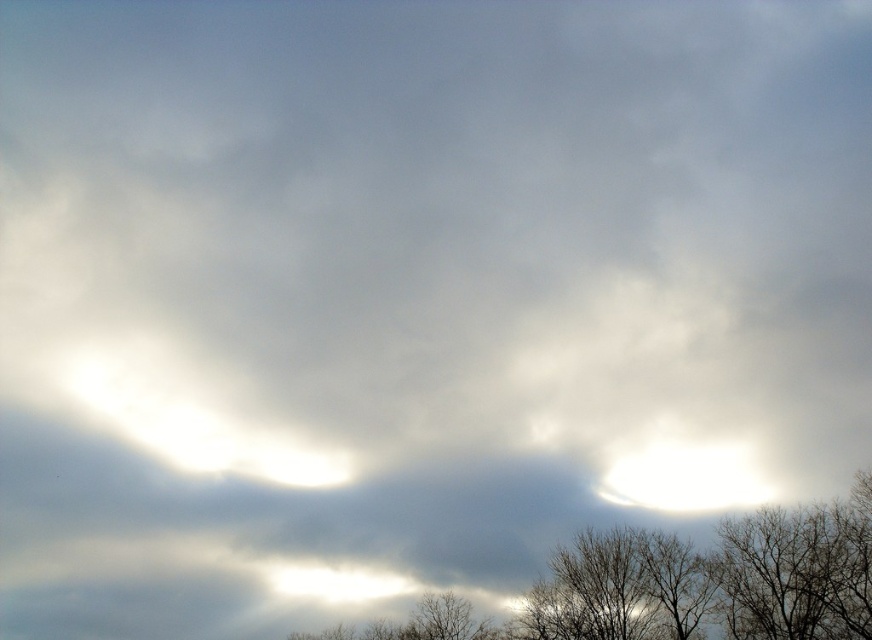
Can you confirm if bare branches at lower center is taller than bare branches at lower right?

Yes.

Between bare branches at lower center and bare branches at lower right, which one has more height?

With more height is bare branches at lower center.

Who is more forward, (489, 634) or (781, 586)?

Point (781, 586)

In order to click on bare branches at lower center in this screenshot , I will do `click(683, 584)`.